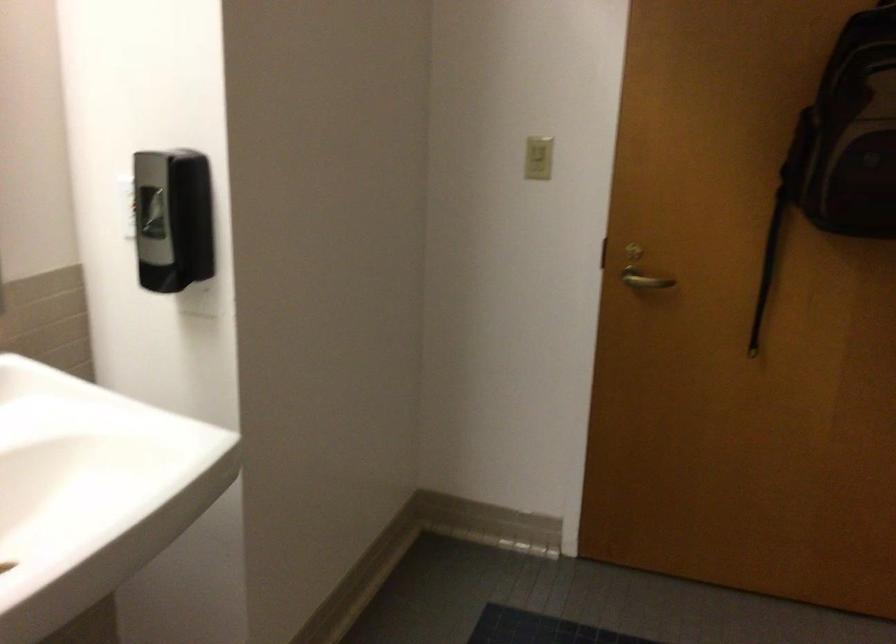
Find the location of `backpack strap`. backpack strap is located at coordinates (767, 267).